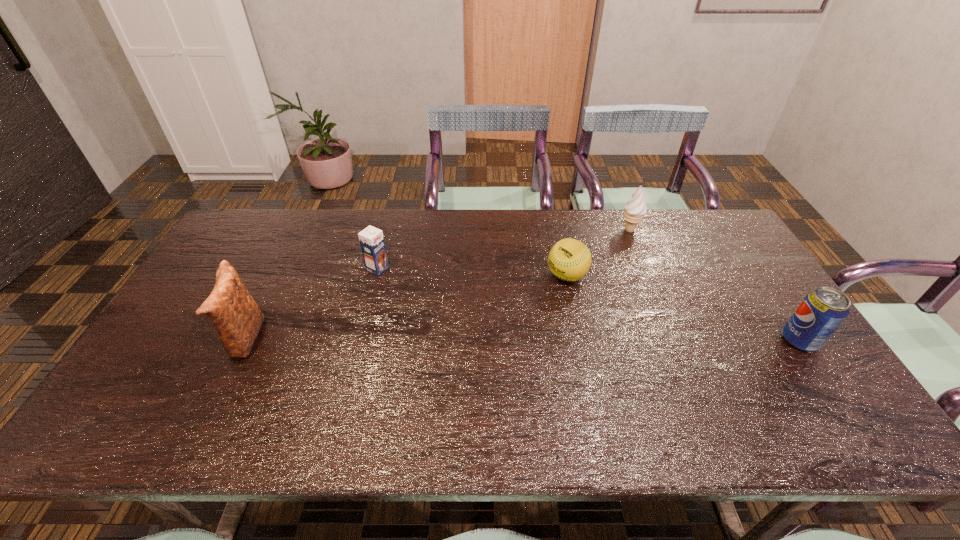
Identify the location of the leftmost object. The image size is (960, 540). (235, 315).

The height and width of the screenshot is (540, 960). I want to click on the rightmost object, so click(x=822, y=311).

Find the location of `the shortest object`. the shortest object is located at coordinates (569, 259).

Locate an element on the screen. The image size is (960, 540). softball is located at coordinates (569, 259).

Locate an element on the screen. This screenshot has width=960, height=540. the fourth object from left to right is located at coordinates (635, 208).

Identify the location of the farthest object. (635, 208).

In order to click on chocolate milk in this screenshot , I will do `click(371, 239)`.

You are a GUI agent. You are given a task and a screenshot of the screen. Output one action in this format:
    pyautogui.click(x=<x>, y=<y>)
    Task: Click on the free point located on the open side of the leftmost object
    The width and height of the screenshot is (960, 540).
    Given the screenshot: What is the action you would take?
    pyautogui.click(x=172, y=339)

Identify the location of vacant area located on the open side of the leftmost object. The width and height of the screenshot is (960, 540). (172, 339).

The image size is (960, 540). What are the coordinates of `free space located on the open side of the leftmost object` in the screenshot? It's located at 191,339.